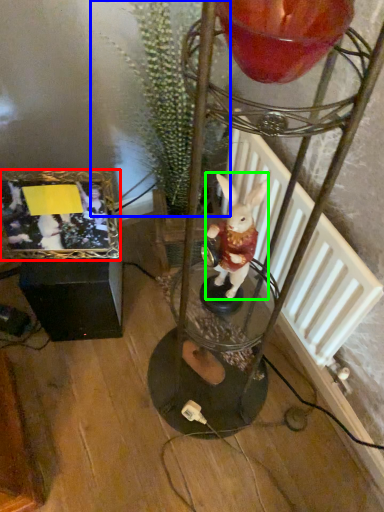
Question: Based on their relative distances, which object is farther from picture frame (highlighted by a red box)? Choose from plant (highlighted by a blue box) and rabbit (highlighted by a green box).

Choices:
 (A) plant
 (B) rabbit

Answer: (B)